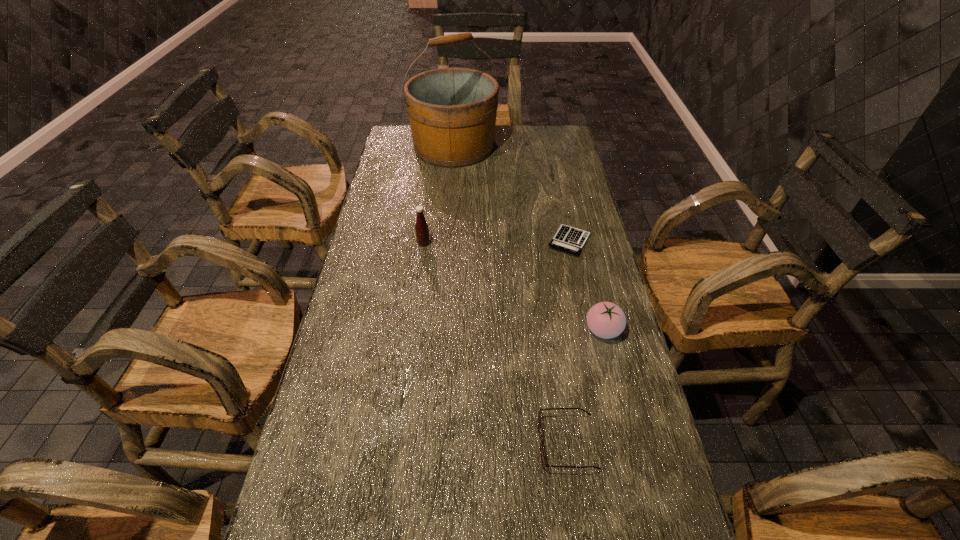
Image resolution: width=960 pixels, height=540 pixels. I want to click on the tallest object, so click(x=452, y=112).

The image size is (960, 540). Identify the location of bucket. (452, 112).

I want to click on the second tallest object, so click(x=422, y=230).

At what (x,y) coordinates should I click in order to perform the action: click on the fourth farthest object. Please return your answer as a coordinate pair (x, y). The width and height of the screenshot is (960, 540). Looking at the image, I should click on (606, 320).

Find the location of a particular element. the third tallest object is located at coordinates (606, 320).

Where is `the nearest object`? The height and width of the screenshot is (540, 960). the nearest object is located at coordinates (542, 455).

The width and height of the screenshot is (960, 540). I want to click on the second shortest object, so click(x=542, y=455).

In order to click on the shortest object in this screenshot , I will do `click(569, 239)`.

You are a GUI agent. You are given a task and a screenshot of the screen. Output one action in this format:
    pyautogui.click(x=<x>, y=<y>)
    Task: Click on the free location located 0.060m on the front of the bucket
    This screenshot has height=540, width=960.
    Given the screenshot: What is the action you would take?
    pyautogui.click(x=451, y=178)

The width and height of the screenshot is (960, 540). In order to click on free space located 0.380m on the front of the Tabasco sauce in this screenshot , I will do `click(410, 346)`.